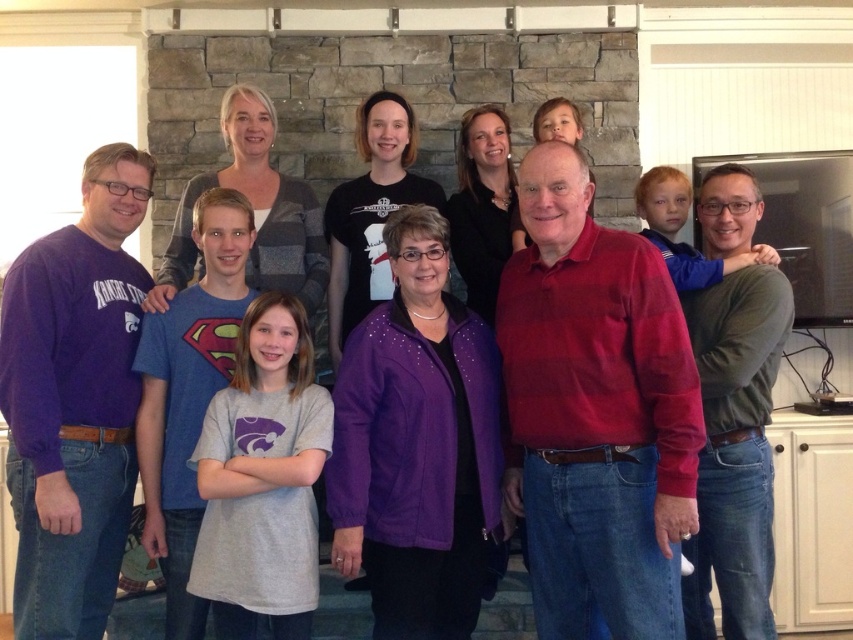
Question: Which object appears farthest from the camera in this image?

Choices:
 (A) red plaid shirt at center
 (B) purple fleece jacket at center
 (C) purple fleece sweatshirt at left

Answer: (C)

Question: Where is red plaid shirt at center located in relation to purple fleece sweatshirt at left in the image?

Choices:
 (A) above
 (B) below

Answer: (A)

Question: Which object appears farthest from the camera in this image?

Choices:
 (A) purple fleece jacket at center
 (B) green sweater at center
 (C) red plaid shirt at center
 (D) purple fleece sweatshirt at left

Answer: (B)

Question: Estimate the real-world distances between objects in this image. Which object is closer to the purple fleece jacket at center?

Choices:
 (A) red plaid shirt at center
 (B) green sweater at center
 (C) purple fleece sweatshirt at left

Answer: (A)

Question: Is purple fleece jacket at center bigger than purple fleece sweatshirt at left?

Choices:
 (A) yes
 (B) no

Answer: (A)

Question: From the image, what is the correct spatial relationship of purple fleece jacket at center in relation to green sweater at center?

Choices:
 (A) below
 (B) above

Answer: (A)